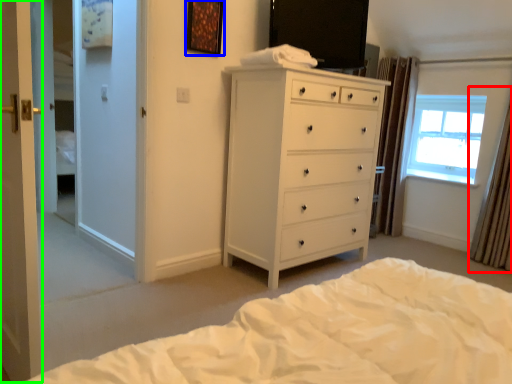
Question: Which object is positioned farthest from curtain (highlighted by a red box)? Select from picture frame (highlighted by a blue box) and screen door (highlighted by a green box).

Choices:
 (A) picture frame
 (B) screen door

Answer: (B)